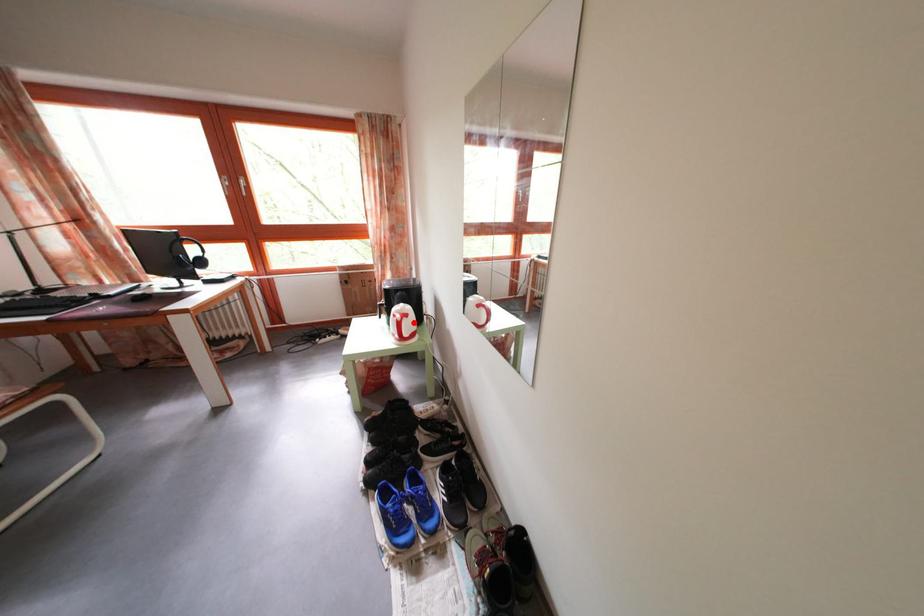
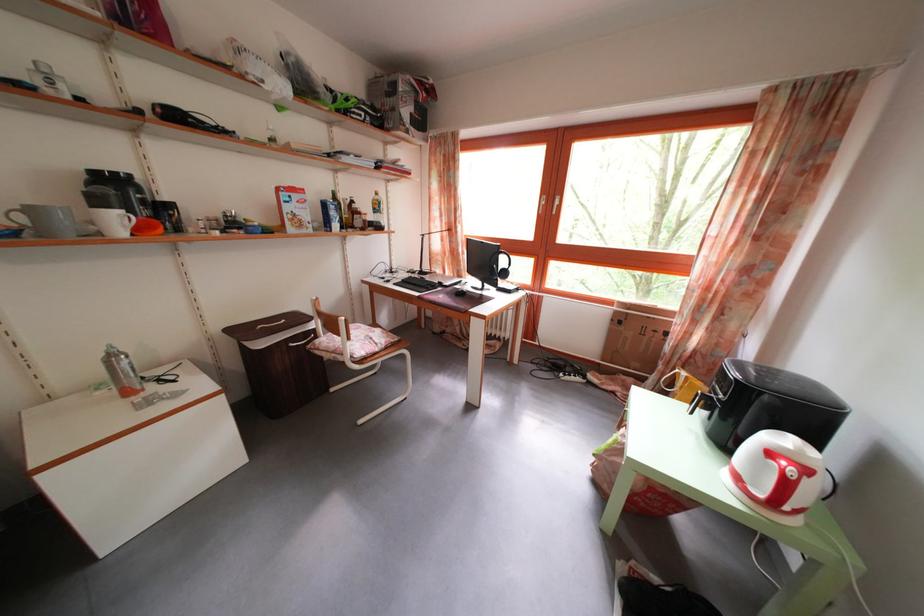
Locate, in the second image, the point that corresponds to the highlighted location in the first image.

(812, 477)